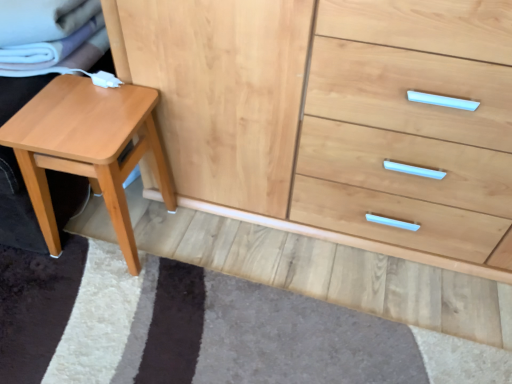
Question: Does light brown wood stool at left appear on the left side of natural wood chest of drawers at center?

Choices:
 (A) no
 (B) yes

Answer: (B)

Question: Is natural wood chest of drawers at center completely or partially inside light brown wood stool at left?

Choices:
 (A) no
 (B) yes

Answer: (A)

Question: Can you confirm if light brown wood stool at left is smaller than natural wood chest of drawers at center?

Choices:
 (A) yes
 (B) no

Answer: (A)

Question: Can you confirm if light brown wood stool at left is wider than natural wood chest of drawers at center?

Choices:
 (A) no
 (B) yes

Answer: (A)

Question: Is light brown wood stool at left positioned before natural wood chest of drawers at center?

Choices:
 (A) no
 (B) yes

Answer: (A)

Question: From the image's perspective, is light brown wood stool at left located beneath natural wood chest of drawers at center?

Choices:
 (A) no
 (B) yes

Answer: (B)

Question: From the image's perspective, would you say natural wood chest of drawers at center is shown under light brown wood stool at left?

Choices:
 (A) yes
 (B) no

Answer: (B)

Question: Is natural wood chest of drawers at center to the left of light brown wood stool at left from the viewer's perspective?

Choices:
 (A) yes
 (B) no

Answer: (B)

Question: From a real-world perspective, is natural wood chest of drawers at center positioned over light brown wood stool at left based on gravity?

Choices:
 (A) yes
 (B) no

Answer: (A)

Question: Is natural wood chest of drawers at center outside light brown wood stool at left?

Choices:
 (A) yes
 (B) no

Answer: (A)

Question: Is natural wood chest of drawers at center surrounding light brown wood stool at left?

Choices:
 (A) yes
 (B) no

Answer: (B)

Question: From the image's perspective, is natural wood chest of drawers at center above light brown wood stool at left?

Choices:
 (A) yes
 (B) no

Answer: (A)

Question: In terms of width, does light brown wood stool at left look wider or thinner when compared to natural wood chest of drawers at center?

Choices:
 (A) wide
 (B) thin

Answer: (B)